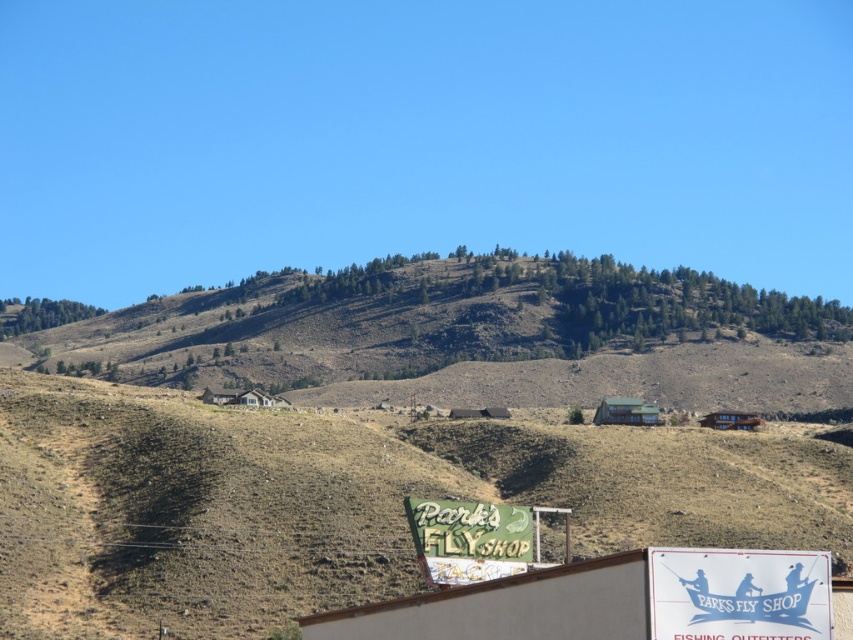
Question: Which object is farther from the camera taking this photo?

Choices:
 (A) green textured hillside at upper center
 (B) white paper sign at lower center

Answer: (A)

Question: Which point is closer to the camera taking this photo?

Choices:
 (A) (753, 609)
 (B) (816, 388)

Answer: (A)

Question: Which point is farther to the camera?

Choices:
 (A) click(672, 595)
 (B) click(289, 285)
 (C) click(422, 557)

Answer: (B)

Question: Does green textured hillside at upper center appear on the left side of white paper sign at lower center?

Choices:
 (A) no
 (B) yes

Answer: (B)

Question: Where is white paper sign at lower center located in relation to green painted wood sign at lower center in the image?

Choices:
 (A) above
 (B) below

Answer: (A)

Question: Is green textured hillside at upper center to the left of green painted wood sign at lower center from the viewer's perspective?

Choices:
 (A) yes
 (B) no

Answer: (A)